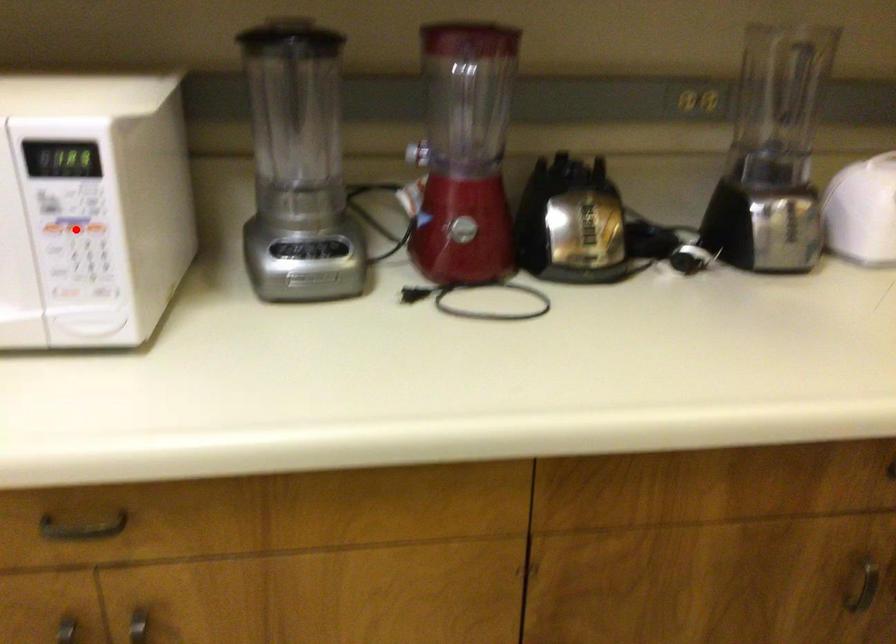
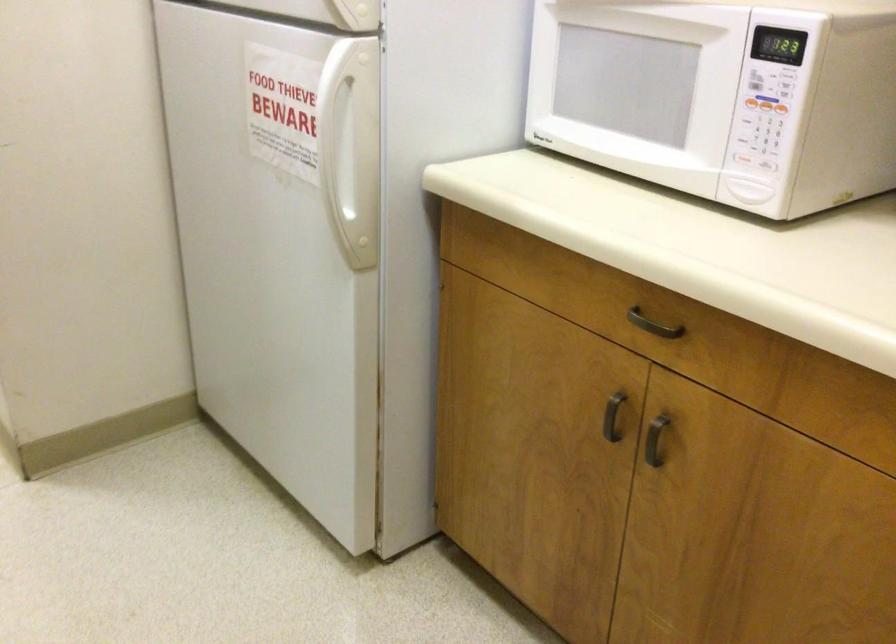
Question: I am providing you with two images of the same scene from different viewpoints. Given a red point in image1, look at the same physical point in image2. Is it:

Choices:
 (A) Closer to the viewpoint
 (B) Farther from the viewpoint

Answer: (B)